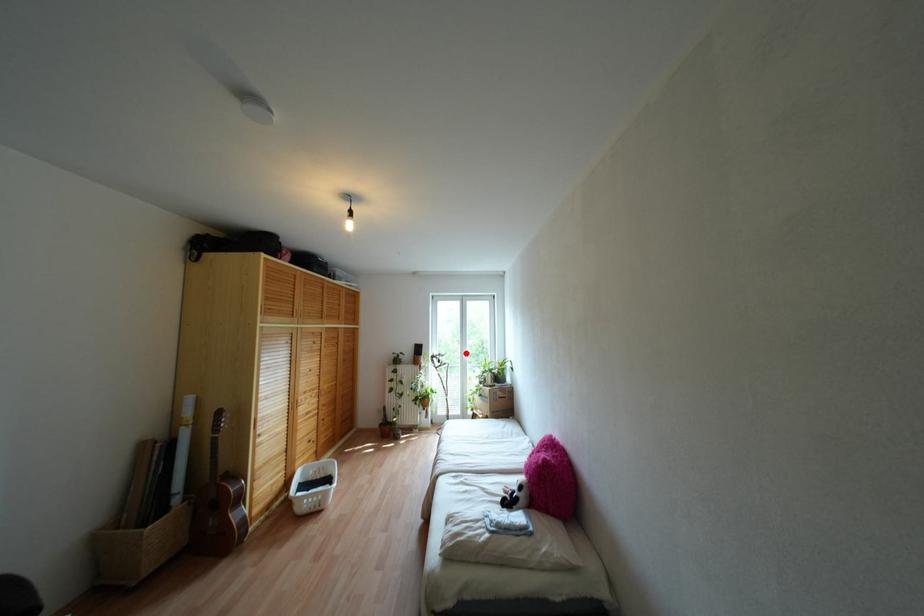
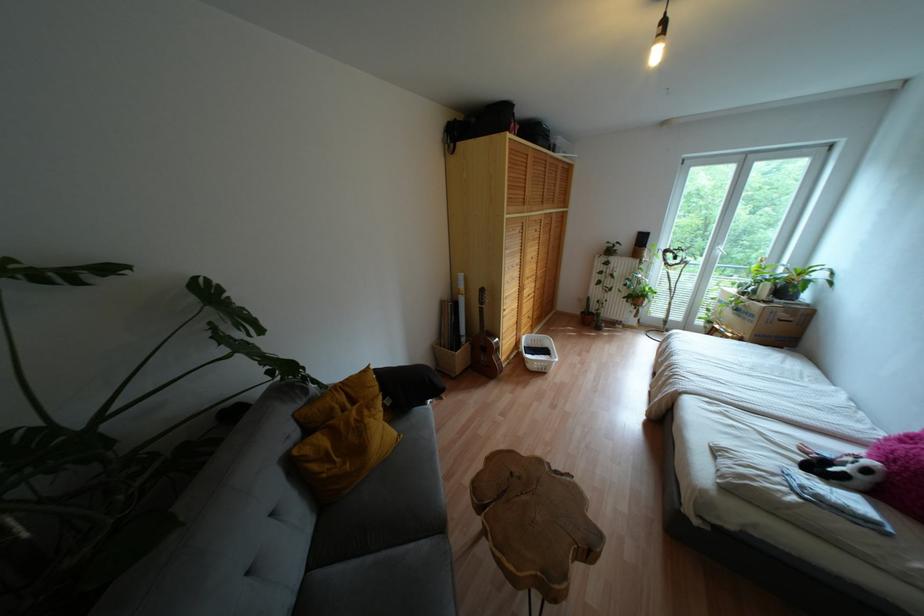
Find the pixel in the second image that matches the highlighted location in the first image.

(723, 248)